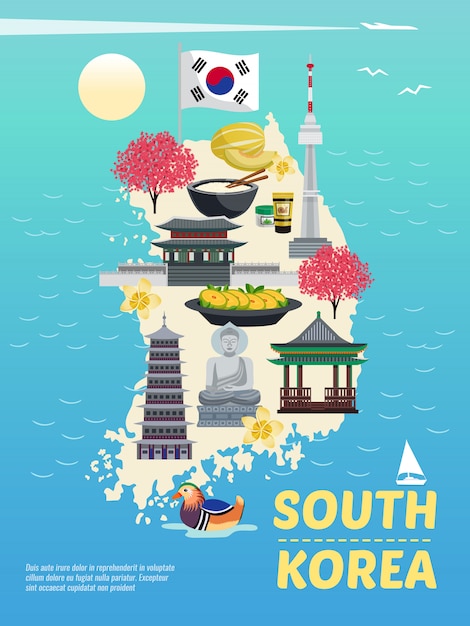
The image size is (470, 626). In order to click on bowl in this screenshot , I will do `click(231, 207)`.